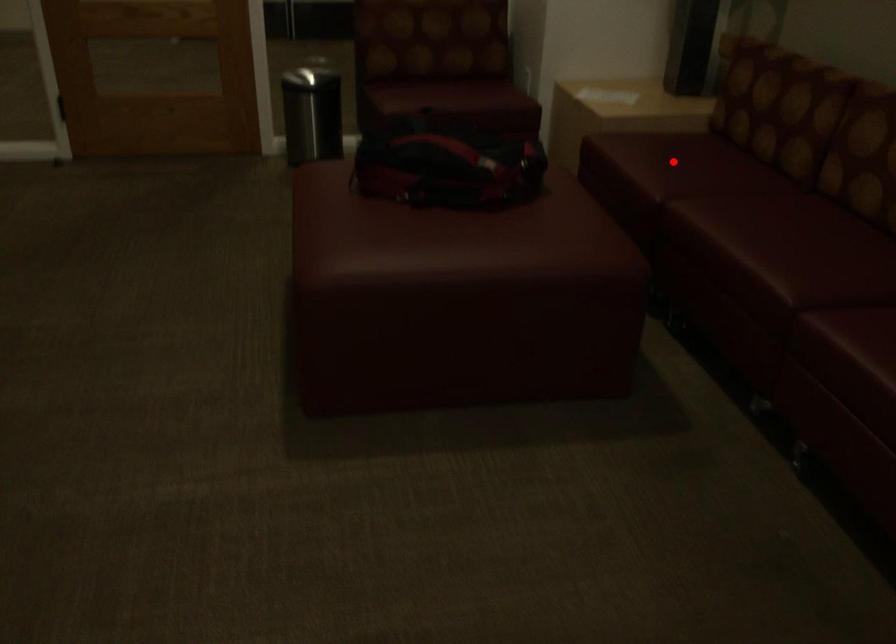
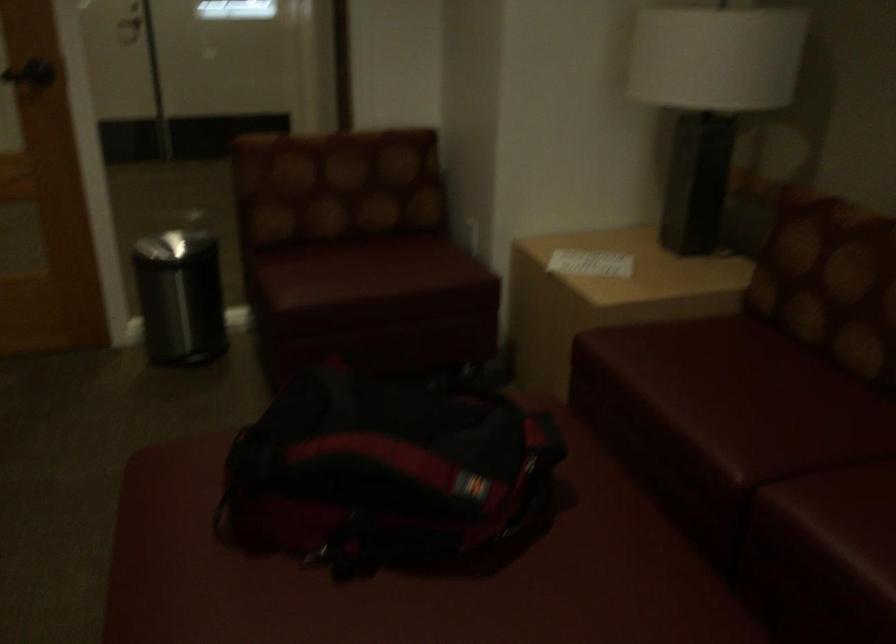
Question: I am providing you with two images of the same scene from different viewpoints. A red point is shown in image1. For the corresponding object point in image2, is it positioned nearer or farther from the camera?

Choices:
 (A) Nearer
 (B) Farther

Answer: (A)